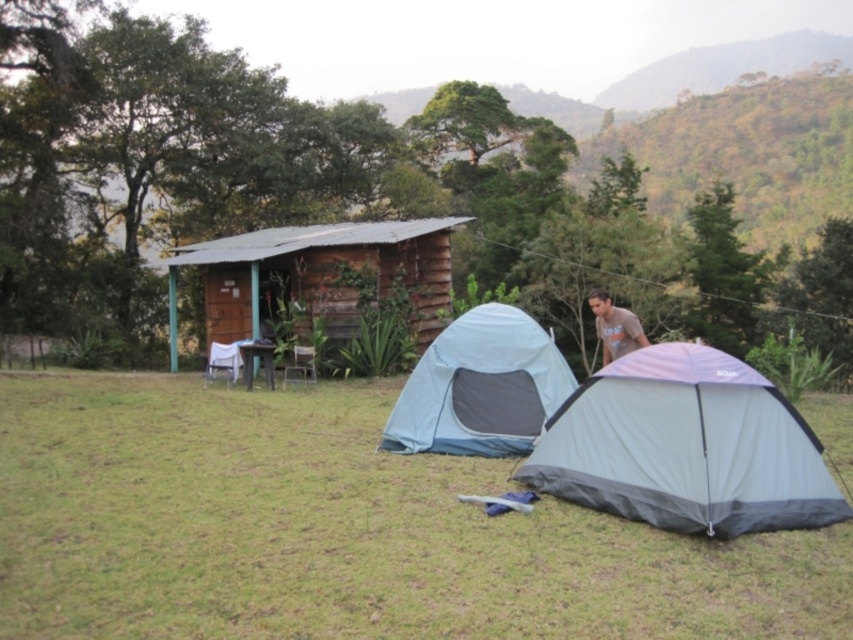
Consider the image. You are standing in the camping scene and want to know which of the two points, point (242, 308) or point (592, 300), is closer to you. Can you determine this based on their positions?

Point (242, 308) is closer to you because it is further to the viewer than point (592, 300).

You are standing at the camera position looking at the camping scene. There are two points marked in the image. The first point is at coordinate point (711, 628) and the second point is at coordinate point (606, 472). Which point is closer to you?

Point (711, 628) is closer to the camera than point (606, 472).